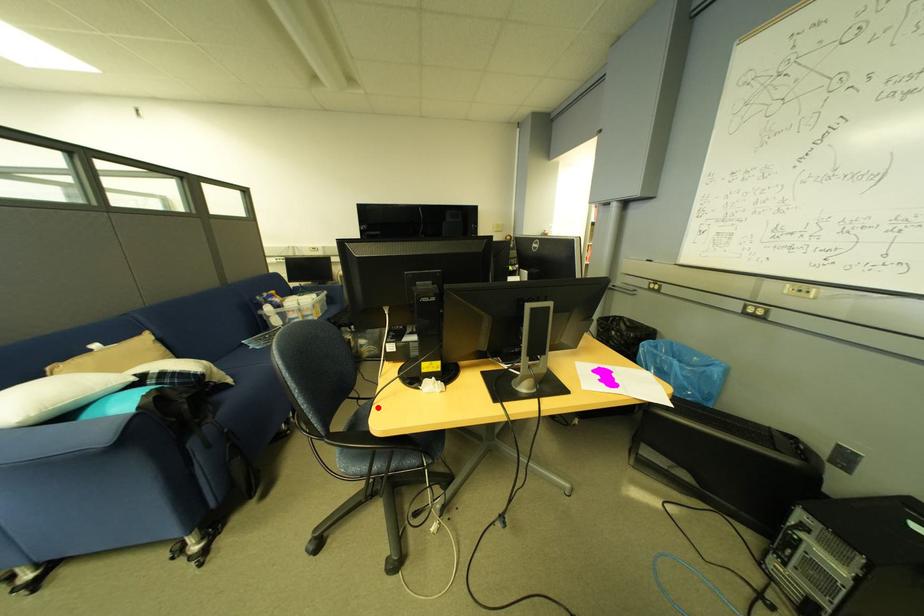
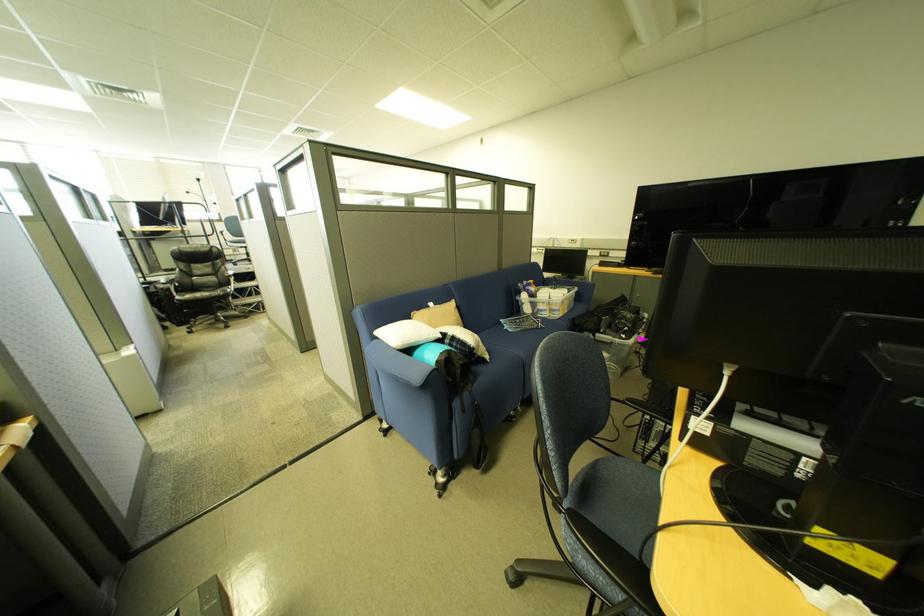
Where in the second image is the point corresponding to the highlighted location from the first image?

(623, 467)